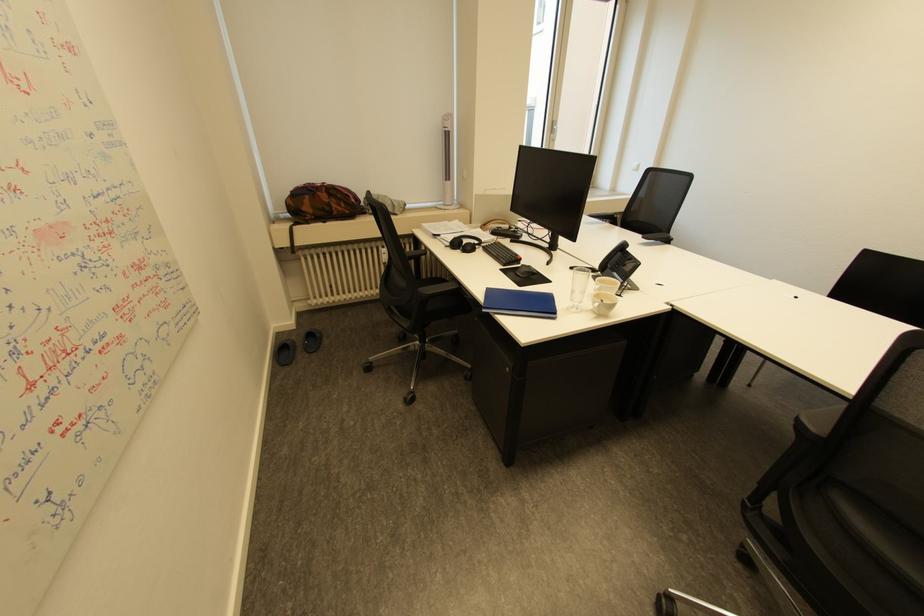
Image resolution: width=924 pixels, height=616 pixels. What do you see at coordinates (525, 270) in the screenshot? I see `a black computer mouse` at bounding box center [525, 270].